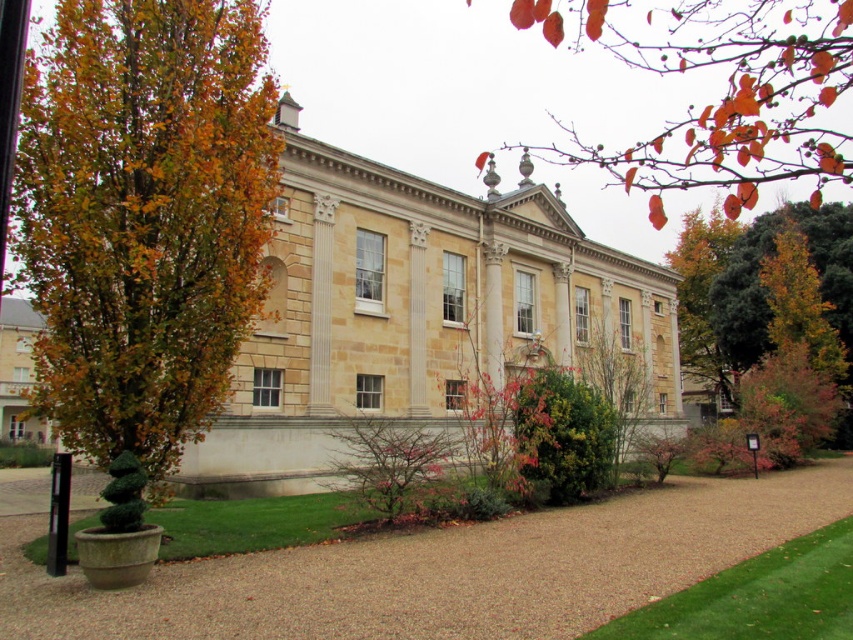
You are a landscape architect designing a garden layout. You need to determine if the orange leafy branch at upper right can be placed over the green grass at lower right without blocking the pathway. Based on their widths, is this feasible?

The orange leafy branch at upper right might be wider than green grass at lower right, so there is a possibility that placing it over the green grass at lower right could block the pathway. Further measurements are needed to confirm.